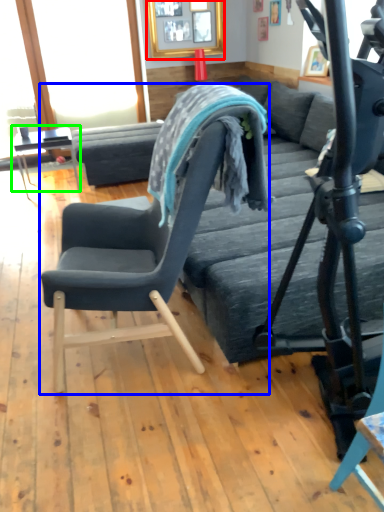
Question: Which object is the closest to the picture frame (highlighted by a red box)? Choose among these: chair (highlighted by a blue box) or table (highlighted by a green box).

Choices:
 (A) chair
 (B) table

Answer: (B)